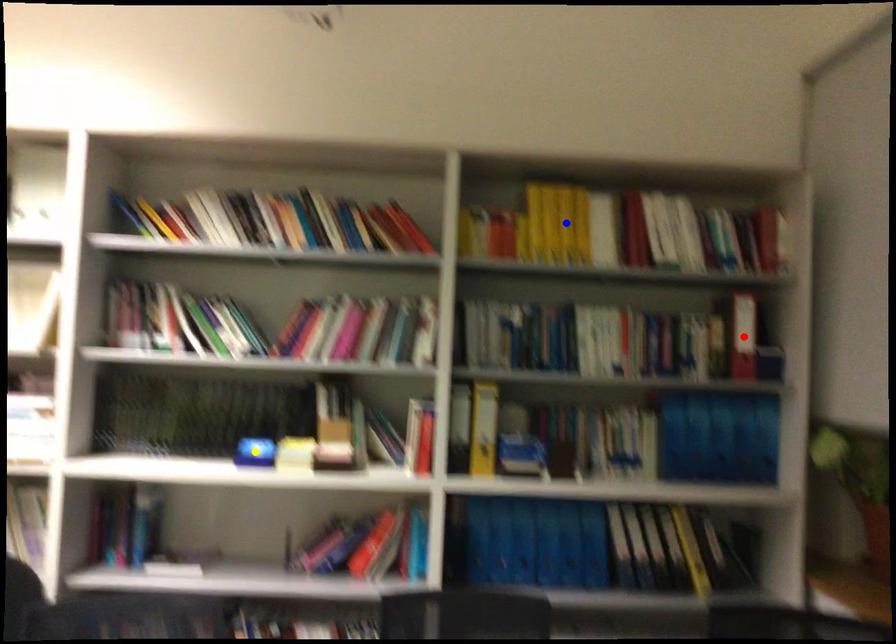
Order these from nearest to farthest:
blue point | red point | yellow point

blue point → red point → yellow point